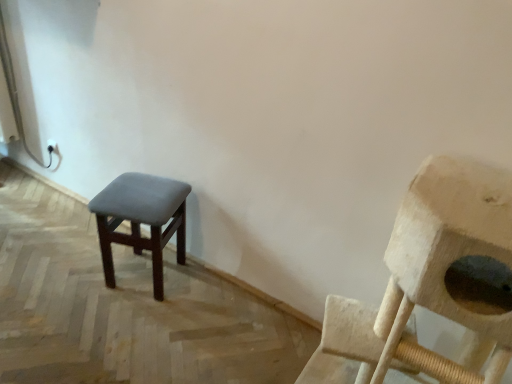
The height and width of the screenshot is (384, 512). What are the coordinates of `wooden cat tree at right` in the screenshot? It's located at (432, 282).

The height and width of the screenshot is (384, 512). Describe the element at coordinates (432, 282) in the screenshot. I see `wooden cat tree at right` at that location.

What is the approximate width of wooden cat tree at right?

The width of wooden cat tree at right is 26.75 inches.

This screenshot has height=384, width=512. I want to click on dark gray fabric stool at left, so click(141, 219).

What do you see at coordinates (141, 219) in the screenshot? I see `dark gray fabric stool at left` at bounding box center [141, 219].

Identify the location of wooden cat tree at right. The height and width of the screenshot is (384, 512). (432, 282).

Consider the image. Is dark gray fabric stool at left at the right side of wooden cat tree at right?

No.

Which object is more forward, dark gray fabric stool at left or wooden cat tree at right?

wooden cat tree at right is in front.

Is point (165, 232) more distant than point (377, 313)?

Yes, point (165, 232) is behind point (377, 313).

From the image's perspective, which one is positioned lower, dark gray fabric stool at left or wooden cat tree at right?

wooden cat tree at right, from the image's perspective.

From a real-world perspective, is dark gray fabric stool at left physically below wooden cat tree at right?

Yes, from a real-world perspective, dark gray fabric stool at left is below wooden cat tree at right.

Between dark gray fabric stool at left and wooden cat tree at right, which one has larger width?

wooden cat tree at right.

Which of these two, dark gray fabric stool at left or wooden cat tree at right, stands shorter?

dark gray fabric stool at left is shorter.

Who is smaller, dark gray fabric stool at left or wooden cat tree at right?

dark gray fabric stool at left is smaller.

Is dark gray fabric stool at left not inside wooden cat tree at right?

Yes, dark gray fabric stool at left is located beyond the bounds of wooden cat tree at right.

Is there a large distance between dark gray fabric stool at left and wooden cat tree at right?

dark gray fabric stool at left is near wooden cat tree at right, not far away.

Is dark gray fabric stool at left oriented away from wooden cat tree at right?

dark gray fabric stool at left does not have its back to wooden cat tree at right.

How many degrees apart are the facing directions of dark gray fabric stool at left and wooden cat tree at right?

They differ by 20.2 degrees in their facing directions.

Measure the distance from dark gray fabric stool at left to wooden cat tree at right.

dark gray fabric stool at left is 37.52 inches from wooden cat tree at right.

At what (x,y) coordinates should I click in order to perform the action: click on chair lying on the right of dark gray fabric stool at left. Please return your answer as a coordinate pair (x, y). The height and width of the screenshot is (384, 512). Looking at the image, I should click on (432, 282).

Can you confirm if wooden cat tree at right is positioned to the right of dark gray fabric stool at left?

Yes, wooden cat tree at right is to the right of dark gray fabric stool at left.

Which object is more forward, wooden cat tree at right or dark gray fabric stool at left?

wooden cat tree at right is closer to the camera.

Is point (405, 251) behind point (168, 234)?

No, it is not.

From the image's perspective, relative to dark gray fabric stool at left, is wooden cat tree at right above or below?

From the image's perspective, wooden cat tree at right appears below dark gray fabric stool at left.

From a real-world perspective, which is physically above, wooden cat tree at right or dark gray fabric stool at left?

From a 3D spatial view, wooden cat tree at right is above.

In the scene shown: Considering the sizes of objects wooden cat tree at right and dark gray fabric stool at left in the image provided, who is thinner, wooden cat tree at right or dark gray fabric stool at left?

dark gray fabric stool at left is thinner.

Considering the sizes of objects wooden cat tree at right and dark gray fabric stool at left in the image provided, who is taller, wooden cat tree at right or dark gray fabric stool at left?

wooden cat tree at right is taller.

Which of these two, wooden cat tree at right or dark gray fabric stool at left, is smaller?

dark gray fabric stool at left is smaller.

Is wooden cat tree at right outside of dark gray fabric stool at left?

Yes, wooden cat tree at right is outside of dark gray fabric stool at left.

Is wooden cat tree at right far away from dark gray fabric stool at left?

Actually, wooden cat tree at right and dark gray fabric stool at left are a little close together.

In the scene shown: Is wooden cat tree at right facing away from dark gray fabric stool at left?

No, wooden cat tree at right's orientation is not away from dark gray fabric stool at left.

You are a GUI agent. You are given a task and a screenshot of the screen. Output one action in this format:
    pyautogui.click(x=<x>, y=<y>)
    Task: Click on the chair located on the right of dark gray fabric stool at left
    This screenshot has width=512, height=384.
    Given the screenshot: What is the action you would take?
    pyautogui.click(x=432, y=282)

This screenshot has height=384, width=512. What are the coordinates of `stool behind the wooden cat tree at right` in the screenshot? It's located at (141, 219).

Image resolution: width=512 pixels, height=384 pixels. In order to click on stool on the left of the wooden cat tree at right in this screenshot , I will do `click(141, 219)`.